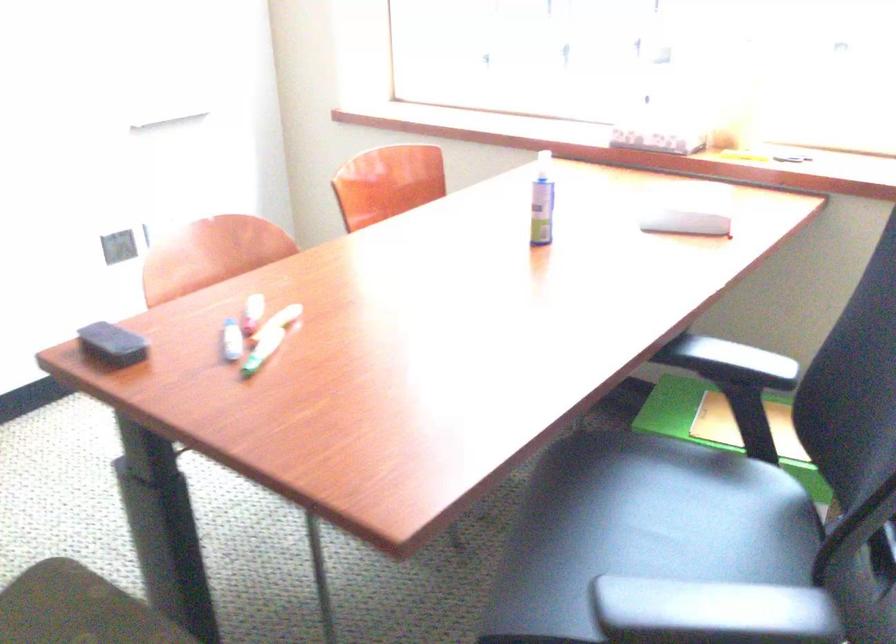
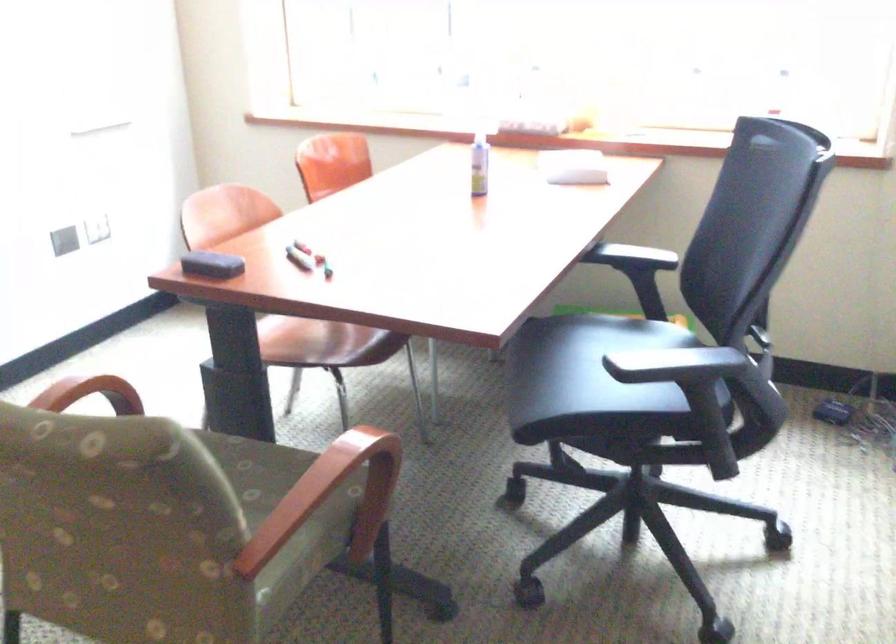
Where in the second image is the point corresponding to (114,339) from the first image?

(211, 265)